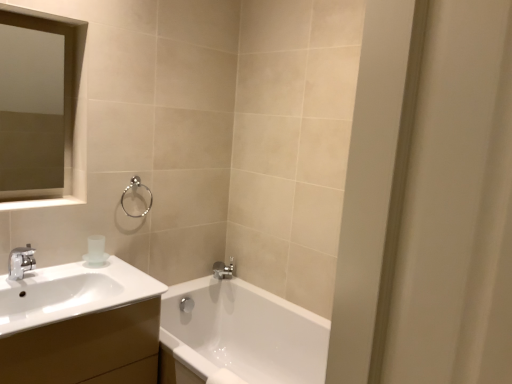
Question: Is satin silver towel ring at upper center wider or thinner than white glossy cabinet at left?

Choices:
 (A) thin
 (B) wide

Answer: (A)

Question: Is satin silver towel ring at upper center taller or shorter than white glossy cabinet at left?

Choices:
 (A) tall
 (B) short

Answer: (B)

Question: Estimate the real-world distances between objects in this image. Which object is farther from the transparent frosted glass cup at upper left?

Choices:
 (A) polished chrome faucet at lower center
 (B) white glossy balustrade at upper left
 (C) matte glass medicine cabinet at upper left
 (D) satin silver towel ring at upper center
 (E) white glossy cabinet at left

Answer: (A)

Question: Which is farther from the polished chrome faucet at lower center?

Choices:
 (A) transparent frosted glass cup at upper left
 (B) white glossy balustrade at upper left
 (C) white glossy cabinet at left
 (D) matte glass medicine cabinet at upper left
 (E) satin silver towel ring at upper center

Answer: (D)